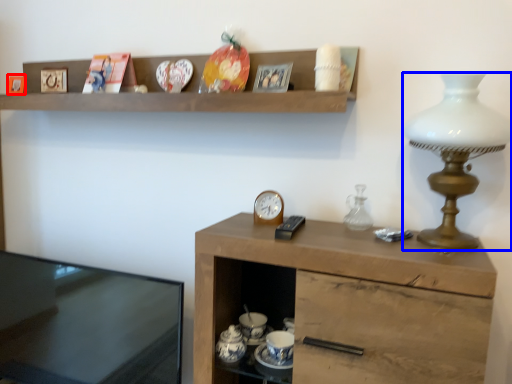
Question: Which object is closer to the camera taking this photo, picture frame (highlighted by a red box) or lamp (highlighted by a blue box)?

Choices:
 (A) picture frame
 (B) lamp

Answer: (B)